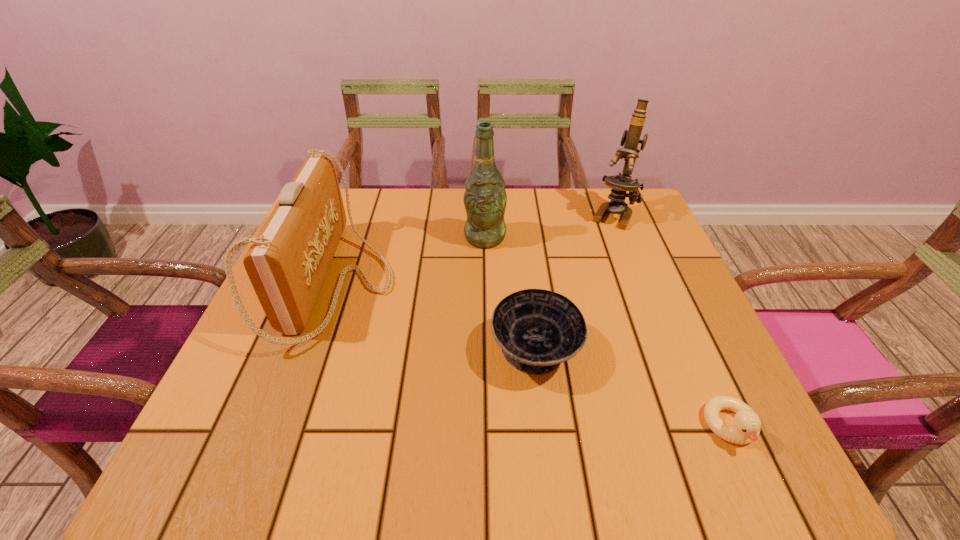
At what (x,y) coordinates should I click in order to perform the action: click on vacant area between the microscope and the second shortest object. Please return your answer as a coordinate pair (x, y). Image resolution: width=960 pixels, height=540 pixels. Looking at the image, I should click on (575, 284).

Where is `free spot between the shortest object and the microscope`? free spot between the shortest object and the microscope is located at coordinates (672, 321).

Where is `free point between the beer bottle and the shortest object`? free point between the beer bottle and the shortest object is located at coordinates (608, 332).

I want to click on free area in between the microscope and the nearest object, so click(x=672, y=321).

Locate an element on the screen. object that is the third closest to the bowl is located at coordinates (485, 198).

The image size is (960, 540). I want to click on object that is the third closest one to the microscope, so click(x=287, y=263).

Locate an element on the screen. The height and width of the screenshot is (540, 960). free spot that satisfies the following two spatial constraints: 1. on the decorative side of the second shortest object; 2. on the left side of the leftmost object is located at coordinates (314, 352).

You are a GUI agent. You are given a task and a screenshot of the screen. Output one action in this format:
    pyautogui.click(x=<x>, y=<y>)
    Task: Click on the vacant point that satisfies the following two spatial constraints: 1. on the back side of the fourth tallest object; 2. on the decorative side of the leftmost object
    The width and height of the screenshot is (960, 540).
    Given the screenshot: What is the action you would take?
    coord(527,282)

The image size is (960, 540). What are the coordinates of `vacant area that satisfies the following two spatial constraints: 1. on the decorative side of the second shortest object; 2. on the right side of the leftmost object` in the screenshot? It's located at (314, 352).